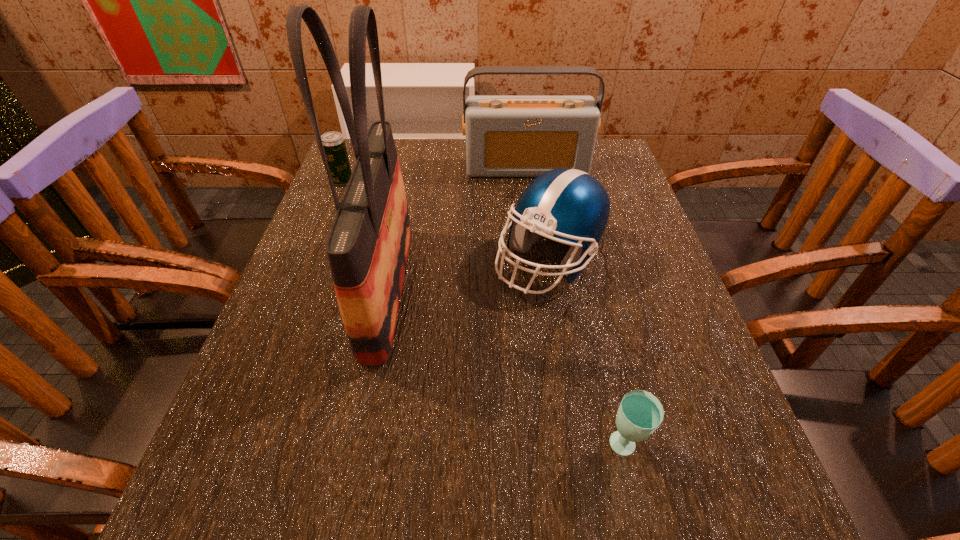
You are a GUI agent. You are given a task and a screenshot of the screen. Output one action in this format:
    pyautogui.click(x=<x>, y=<y>)
    Task: Click on the second object from left to right
    This screenshot has width=960, height=540.
    Given the screenshot: What is the action you would take?
    pyautogui.click(x=368, y=244)

The height and width of the screenshot is (540, 960). Find the location of `shopping bag`. shopping bag is located at coordinates (368, 244).

Where is `radio receiver`? radio receiver is located at coordinates (506, 136).

The height and width of the screenshot is (540, 960). Identify the location of the third shortest object. (569, 204).

You are a GUI agent. You are given a task and a screenshot of the screen. Output one action in this format:
    pyautogui.click(x=<x>, y=<y>)
    Task: Click on the beer can
    Image resolution: width=960 pixels, height=540 pixels.
    Given the screenshot: What is the action you would take?
    pyautogui.click(x=334, y=145)

Locate an element on the screen. glass is located at coordinates point(640,412).

This screenshot has width=960, height=540. I want to click on free space located 0.360m on the front-facing side of the shopping bag, so [588, 289].

The width and height of the screenshot is (960, 540). Find the location of `vacant space located 0.380m on the front-facing side of the fourth shortest object`. vacant space located 0.380m on the front-facing side of the fourth shortest object is located at coordinates (542, 277).

This screenshot has height=540, width=960. I want to click on free spot located at the front of the football helmet with the faceguard, so click(563, 346).

Locate an element on the screen. Image resolution: width=960 pixels, height=540 pixels. free space located 0.270m on the right of the beer can is located at coordinates (453, 181).